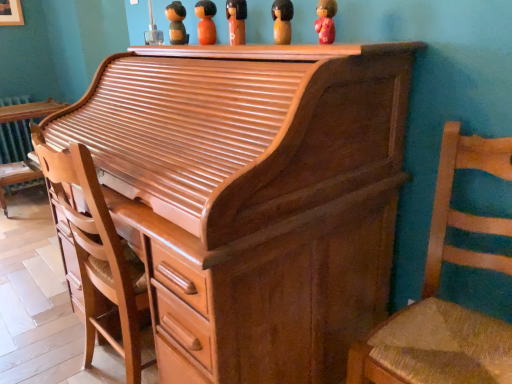
Identify the location of matte pink figurine at upper center, the first toy viewed from the front. The width and height of the screenshot is (512, 384). (325, 21).

Where is `wooden figurine at upper center, marked as the 2th toy in a right-to-left arrangement`? The height and width of the screenshot is (384, 512). wooden figurine at upper center, marked as the 2th toy in a right-to-left arrangement is located at coordinates (282, 21).

From the image's perspective, is matte pink figurine at upper center, arranged as the first toy when viewed from the right, on matte orange doll at upper center, acting as the third toy starting from the back?

No, from the image's perspective, matte pink figurine at upper center, arranged as the first toy when viewed from the right, is not on top of matte orange doll at upper center, acting as the third toy starting from the back.

Could you measure the distance between matte pink figurine at upper center, the fifth toy when ordered from left to right, and matte orange doll at upper center, the third toy positioned from the front?

matte pink figurine at upper center, the fifth toy when ordered from left to right, and matte orange doll at upper center, the third toy positioned from the front, are 13.91 inches apart from each other.

Between matte pink figurine at upper center, the first toy viewed from the front, and matte orange doll at upper center, which ranks as the 3th toy in right-to-left order, which one has larger size?

With larger size is matte orange doll at upper center, which ranks as the 3th toy in right-to-left order.

From the picture: Does matte pink figurine at upper center, the first toy viewed from the front, lie behind matte orange doll at upper center, which ranks as the 3th toy in right-to-left order?

No, it is in front of matte orange doll at upper center, which ranks as the 3th toy in right-to-left order.

Locate an element on the screen. piano located underneath the orange matte wooden doll at center, which ranks as the 2th toy in left-to-right order (from a real-world perspective) is located at coordinates (252, 197).

From the image's perspective, is orange matte wooden doll at center, which is the 4th toy in front-to-back order, above shiny brown piano at center?

Yes, from the image's perspective, orange matte wooden doll at center, which is the 4th toy in front-to-back order, is over shiny brown piano at center.

Does orange matte wooden doll at center, which appears as the 2th toy when viewed from the back, have a larger size compared to shiny brown piano at center?

No.

In the scene shown: Can we say light brown wood chair at left, marked as the 2th chair in a right-to-left arrangement, lies outside shiny brown wood desk at left?

Yes, light brown wood chair at left, marked as the 2th chair in a right-to-left arrangement, is not within shiny brown wood desk at left.

This screenshot has width=512, height=384. In order to click on furniture behind the light brown wood chair at left, marked as the 2th chair in a right-to-left arrangement in this screenshot , I will do [x=29, y=111].

Is point (100, 288) closer to viewer compared to point (40, 112)?

Yes, point (100, 288) is closer to viewer.

Between light brown wood chair at left, the first chair in the left-to-right sequence, and shiny brown wood desk at left, which one has larger size?

Bigger between the two is light brown wood chair at left, the first chair in the left-to-right sequence.

Which of these two, light brown wood chair at left, the first chair in the left-to-right sequence, or orange matte wooden doll at center, placed as the 4th toy when sorted from right to left, is thinner?

orange matte wooden doll at center, placed as the 4th toy when sorted from right to left, is thinner.

Which is in front, light brown wood chair at left, marked as the 2th chair in a right-to-left arrangement, or orange matte wooden doll at center, placed as the 4th toy when sorted from right to left?

light brown wood chair at left, marked as the 2th chair in a right-to-left arrangement, is in front.

Considering the sizes of objects light brown wood chair at left, the first chair in the left-to-right sequence, and orange matte wooden doll at center, placed as the 4th toy when sorted from right to left, in the image provided, who is smaller, light brown wood chair at left, the first chair in the left-to-right sequence, or orange matte wooden doll at center, placed as the 4th toy when sorted from right to left,?

With smaller size is orange matte wooden doll at center, placed as the 4th toy when sorted from right to left.

Is light brown wood chair at left, the first chair in the left-to-right sequence, surrounding orange matte wooden doll at center, which is the 4th toy in front-to-back order?

No, orange matte wooden doll at center, which is the 4th toy in front-to-back order, is not a part of light brown wood chair at left, the first chair in the left-to-right sequence.

From the image's perspective, is matte orange doll at upper center, acting as the third toy starting from the back, located above or below wooden figurine at upper center, acting as the first toy starting from the left?

Based on their image positions, matte orange doll at upper center, acting as the third toy starting from the back, is located beneath wooden figurine at upper center, acting as the first toy starting from the left.

The image size is (512, 384). What are the coordinates of `the 2nd toy behind the matte orange doll at upper center, which ranks as the 3th toy in right-to-left order` in the screenshot? It's located at (176, 23).

Considering the relative sizes of matte orange doll at upper center, acting as the third toy starting from the back, and wooden figurine at upper center, positioned as the fifth toy in right-to-left order, in the image provided, is matte orange doll at upper center, acting as the third toy starting from the back, taller than wooden figurine at upper center, positioned as the fifth toy in right-to-left order,?

No, matte orange doll at upper center, acting as the third toy starting from the back, is not taller than wooden figurine at upper center, positioned as the fifth toy in right-to-left order.

Does matte orange doll at upper center, which ranks as the 3th toy in right-to-left order, appear on the left side of wooden figurine at upper center, acting as the first toy starting from the left?

Incorrect, matte orange doll at upper center, which ranks as the 3th toy in right-to-left order, is not on the left side of wooden figurine at upper center, acting as the first toy starting from the left.

Is matte pink figurine at upper center, the fifth toy when ordered from left to right, to the right of wooden figurine at upper center, which appears as the 1th toy when viewed from the back, from the viewer's perspective?

Yes.

From a real-world perspective, is matte pink figurine at upper center, the 5th toy in the back-to-front sequence, under wooden figurine at upper center, placed as the fifth toy when sorted from front to back?

Correct, in the physical world, matte pink figurine at upper center, the 5th toy in the back-to-front sequence, is lower than wooden figurine at upper center, placed as the fifth toy when sorted from front to back.

Is there a large distance between matte pink figurine at upper center, arranged as the first toy when viewed from the right, and wooden figurine at upper center, positioned as the fifth toy in right-to-left order?

matte pink figurine at upper center, arranged as the first toy when viewed from the right, is actually quite close to wooden figurine at upper center, positioned as the fifth toy in right-to-left order.

Considering the sizes of objects matte pink figurine at upper center, arranged as the first toy when viewed from the right, and wooden figurine at upper center, acting as the first toy starting from the left, in the image provided, who is taller, matte pink figurine at upper center, arranged as the first toy when viewed from the right, or wooden figurine at upper center, acting as the first toy starting from the left,?

wooden figurine at upper center, acting as the first toy starting from the left.

Looking at this image, how far apart are matte pink figurine at upper center, the first toy viewed from the front, and light brown wood chair at left, marked as the 2th chair in a right-to-left arrangement?

The distance of matte pink figurine at upper center, the first toy viewed from the front, from light brown wood chair at left, marked as the 2th chair in a right-to-left arrangement, is 98.45 centimeters.

From the image's perspective, relative to light brown wood chair at left, the first chair in the left-to-right sequence, is matte pink figurine at upper center, arranged as the first toy when viewed from the right, above or below?

matte pink figurine at upper center, arranged as the first toy when viewed from the right, is above light brown wood chair at left, the first chair in the left-to-right sequence.

From a real-world perspective, relative to light brown wood chair at left, marked as the 2th chair in a right-to-left arrangement, is matte pink figurine at upper center, arranged as the first toy when viewed from the right, vertically above or below?

Clearly, from a real-world perspective, matte pink figurine at upper center, arranged as the first toy when viewed from the right, is above light brown wood chair at left, marked as the 2th chair in a right-to-left arrangement.

Which point is more distant from viewer, (323,17) or (91,314)?

The point (91,314) is behind.

I want to click on the 2nd toy behind the matte pink figurine at upper center, the first toy viewed from the front, counting from the anchor's position, so click(x=236, y=21).

In the image, there is a orange matte wooden doll at center, which is the 4th toy in front-to-back order. Identify the location of piano below it (from the image's perspective). (252, 197).

Looking at the image, which one is located further to matte orange doll at upper center, which is the third toy from left to right, shiny brown piano at center or light brown wood chair at left, the first chair in the left-to-right sequence?

light brown wood chair at left, the first chair in the left-to-right sequence, is further to matte orange doll at upper center, which is the third toy from left to right.

Looking at the image, which one is located further to shiny brown piano at center, matte pink figurine at upper center, the first toy viewed from the front, or wooden woven seat at right, which is counted as the 1th chair, starting from the right?

Among the two, matte pink figurine at upper center, the first toy viewed from the front, is located further to shiny brown piano at center.

Looking at this image, which object lies further to the anchor point matte pink figurine at upper center, the first toy viewed from the front, wooden figurine at upper center, the 4th toy when ordered from left to right, or shiny brown wood desk at left?

shiny brown wood desk at left is positioned further to the anchor matte pink figurine at upper center, the first toy viewed from the front.

Estimate the real-world distances between objects in this image. Which object is further from orange matte wooden doll at center, which appears as the 2th toy when viewed from the back, wooden figurine at upper center, the 4th toy when ordered from left to right, or wooden figurine at upper center, placed as the fifth toy when sorted from front to back?

wooden figurine at upper center, the 4th toy when ordered from left to right, lies further to orange matte wooden doll at center, which appears as the 2th toy when viewed from the back, than the other object.

Looking at the image, which one is located further to light brown wood chair at left, the first chair in the left-to-right sequence, orange matte wooden doll at center, which appears as the 2th toy when viewed from the back, or shiny brown wood desk at left?

shiny brown wood desk at left.

From the image, which object appears to be nearer to wooden figurine at upper center, placed as the fifth toy when sorted from front to back, shiny brown piano at center or wooden woven seat at right, positioned as the 2th chair in left-to-right order?

Among the two, shiny brown piano at center is located nearer to wooden figurine at upper center, placed as the fifth toy when sorted from front to back.

Estimate the real-world distances between objects in this image. Which object is further from shiny brown wood desk at left, wooden woven seat at right, positioned as the 2th chair in left-to-right order, or wooden figurine at upper center, the fourth toy from the back?

wooden woven seat at right, positioned as the 2th chair in left-to-right order, lies further to shiny brown wood desk at left than the other object.

Considering their positions, is wooden figurine at upper center, which appears as the 1th toy when viewed from the back, positioned closer to light brown wood chair at left, the first chair in the left-to-right sequence, than wooden figurine at upper center, the second toy viewed from the front?

wooden figurine at upper center, the second toy viewed from the front, lies closer to light brown wood chair at left, the first chair in the left-to-right sequence, than the other object.

The image size is (512, 384). In order to click on toy between wooden figurine at upper center, the fourth toy from the back, and orange matte wooden doll at center, which ranks as the 2th toy in left-to-right order, along the z-axis in this screenshot , I will do `click(236, 21)`.

Find the location of `chair that lies between matte orange doll at upper center, the third toy positioned from the front, and wooden woven seat at right, which is counted as the 1th chair, starting from the right, from top to bottom`. chair that lies between matte orange doll at upper center, the third toy positioned from the front, and wooden woven seat at right, which is counted as the 1th chair, starting from the right, from top to bottom is located at coordinates (97, 255).

Identify the location of piano that lies between matte pink figurine at upper center, arranged as the first toy when viewed from the right, and wooden woven seat at right, positioned as the 2th chair in left-to-right order, from top to bottom. (252, 197).

Image resolution: width=512 pixels, height=384 pixels. What are the coordinates of `chair between wooden figurine at upper center, the fourth toy from the back, and wooden woven seat at right, positioned as the 2th chair in left-to-right order, in the vertical direction` in the screenshot? It's located at (97, 255).